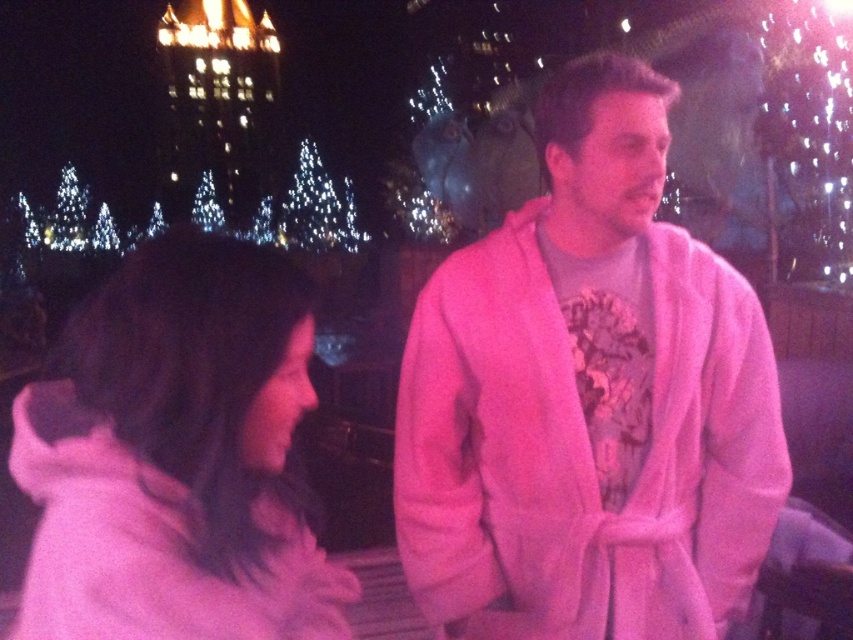
Consider the image. You are a photographer planning to take a group photo of the pink fleece robe at center and the white fluffy coat at left. The camera you are using has a maximum focus range of 30 meters. Will you be able to capture both subjects clearly in the same photo?

The distance between the pink fleece robe at center and the white fluffy coat at left is 32.68 meters. Since the camera can only focus up to 30 meters, it won t be able to capture both subjects clearly in the same photo.

You are standing in a nighttime outdoor event wearing a pink fleece robe at center. You want to reach a nearby bench that is 10 feet away from you. Can you walk directly to the bench without encountering any obstacles?

The pink fleece robe at center and viewer are 310.49 feet apart, so the distance between you and the bench is only 10 feet, which is much shorter than 310.49 feet. Therefore, you can walk directly to the bench without any obstacles in your way.